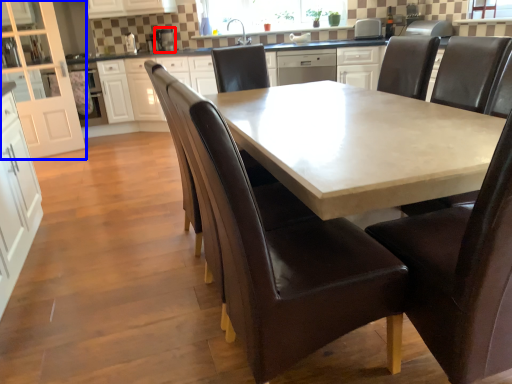
Question: Which of the following is the closest to the observer, appliance (highlighted by a red box) or cabinetry (highlighted by a blue box)?

Choices:
 (A) appliance
 (B) cabinetry

Answer: (B)